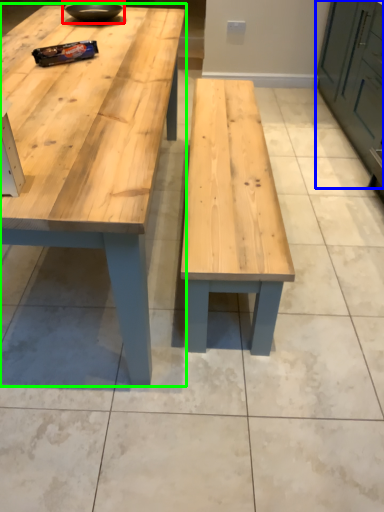
Question: Which is nearer to the bowl (highlighted by a red box)? cabinetry (highlighted by a blue box) or table (highlighted by a green box).

Choices:
 (A) cabinetry
 (B) table

Answer: (B)